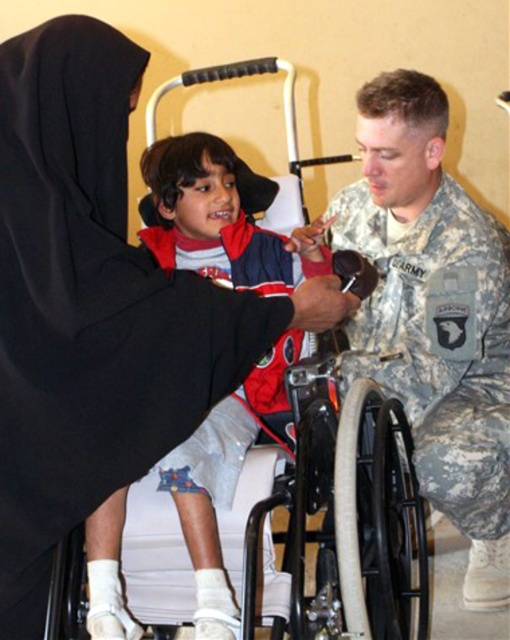
Where is the black fabric at upper left located in the image?

The black fabric at upper left is located at point 2D coordinates of [95,307].

From the picture: You are a designer creating a layout for a poster that must include both the black fabric at upper left and the white plastic wheelchair at center. The poster has limited horizontal space. Based on the image, which object should be placed first if you want to prioritize the wider one?

The black fabric at upper left should be placed first because it might be wider than the white plastic wheelchair at center according to the description.

Where is the black fabric at upper left located in the image?

The black fabric at upper left is located at point (95, 307) in the image.